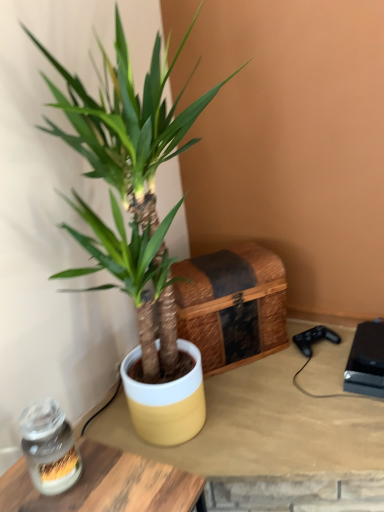
Describe the element at coordinates (232, 304) in the screenshot. The height and width of the screenshot is (512, 384). I see `woven wood chest at center` at that location.

Identify the location of wooden table at lower left, the second table when ordered from back to front. Image resolution: width=384 pixels, height=512 pixels. (107, 485).

What is the approximate width of black plastic game console at lower right?

black plastic game console at lower right is 10.26 inches in width.

The height and width of the screenshot is (512, 384). What do you see at coordinates (366, 361) in the screenshot? I see `black plastic game console at lower right` at bounding box center [366, 361].

Identify the location of yellow matte pot at center, which is the 1th table in back-to-front order. Image resolution: width=384 pixels, height=512 pixels. (264, 429).

In order to face clear glass jar at lower left, should I rotate leftwards or rightwards?

It's best to rotate left around 18.123 degrees.

You are a GUI agent. You are given a task and a screenshot of the screen. Output one action in this format:
    pyautogui.click(x=<x>, y=<y>)
    Task: Click on the woven wood chest at center
    Image resolution: width=384 pixels, height=512 pixels.
    Given the screenshot: What is the action you would take?
    pyautogui.click(x=232, y=304)

Looking at their sizes, would you say yellow matte pot at center, which is counted as the 2th table, starting from the front, is wider or thinner than woven wood chest at center?

In the image, yellow matte pot at center, which is counted as the 2th table, starting from the front, appears to be wider than woven wood chest at center.

Between yellow matte pot at center, which is counted as the 2th table, starting from the front, and woven wood chest at center, which one has less height?

yellow matte pot at center, which is counted as the 2th table, starting from the front.

Does point (262, 401) come farther from viewer compared to point (256, 311)?

No.

Can you tell me how much yellow matte pot at center, which is the 1th table in back-to-front order, and woven wood chest at center differ in facing direction?

yellow matte pot at center, which is the 1th table in back-to-front order, and woven wood chest at center are facing 26.7 degrees away from each other.

Is black plastic game console at lower right surrounded by green matte plant at center?

No, black plastic game console at lower right is not surrounded by green matte plant at center.

Which of these two, green matte plant at center or black plastic game console at lower right, stands taller?

green matte plant at center.

Can you confirm if green matte plant at center is positioned to the left of black plastic game console at lower right?

Correct, you'll find green matte plant at center to the left of black plastic game console at lower right.

Is black plastic game console at lower right at the back of green matte plant at center?

No, green matte plant at center is not facing the opposite direction of black plastic game console at lower right.

Which is closer to the camera, (125,38) or (279,309)?

Point (125,38) is positioned closer to the camera compared to point (279,309).

Which of these two, green matte plant at center or woven wood chest at center, stands taller?

Standing taller between the two is green matte plant at center.

Is green matte plant at center bigger than woven wood chest at center?

Correct, green matte plant at center is larger in size than woven wood chest at center.

Which object is wider, green matte plant at center or woven wood chest at center?

green matte plant at center is wider.

From the image's perspective, which object appears higher, wooden table at lower left, the second table when ordered from back to front, or clear glass jar at lower left?

clear glass jar at lower left is shown above in the image.

Is wooden table at lower left, the second table when ordered from back to front, positioned with its back to clear glass jar at lower left?

That's not correct — wooden table at lower left, the second table when ordered from back to front, is not looking away from clear glass jar at lower left.

Is wooden table at lower left, the first table viewed from the front, to the right of clear glass jar at lower left from the viewer's perspective?

Yes, wooden table at lower left, the first table viewed from the front, is to the right of clear glass jar at lower left.

From a real-world perspective, is wooden table at lower left, the second table when ordered from back to front, on top of clear glass jar at lower left?

No, from a real-world perspective, wooden table at lower left, the second table when ordered from back to front, is not over clear glass jar at lower left

Is yellow matte pot at center, which is the 1th table in back-to-front order, facing away from green matte plant at center?

yellow matte pot at center, which is the 1th table in back-to-front order, does not have its back to green matte plant at center.

From a real-world perspective, does yellow matte pot at center, which is the 1th table in back-to-front order, stand above green matte plant at center?

No, from a real-world perspective, yellow matte pot at center, which is the 1th table in back-to-front order, is not above green matte plant at center.

Can you tell me how much yellow matte pot at center, which is counted as the 2th table, starting from the front, and green matte plant at center differ in facing direction?

yellow matte pot at center, which is counted as the 2th table, starting from the front, and green matte plant at center are facing 65.5 degrees away from each other.

Which object is closer to the camera, yellow matte pot at center, which is the 1th table in back-to-front order, or green matte plant at center?

Positioned in front is green matte plant at center.

Based on the photo, is yellow matte pot at center, which is counted as the 2th table, starting from the front, positioned behind black plastic game console at lower right?

No, yellow matte pot at center, which is counted as the 2th table, starting from the front, is closer to the viewer.

Based on their sizes in the image, would you say yellow matte pot at center, which is counted as the 2th table, starting from the front, is bigger or smaller than black plastic game console at lower right?

yellow matte pot at center, which is counted as the 2th table, starting from the front, is bigger than black plastic game console at lower right.

Is black plastic game console at lower right completely or partially inside yellow matte pot at center, which is counted as the 2th table, starting from the front?

That's incorrect, black plastic game console at lower right is not inside yellow matte pot at center, which is counted as the 2th table, starting from the front.

Can you tell me how much yellow matte pot at center, which is counted as the 2th table, starting from the front, and black plastic game console at lower right differ in facing direction?

There is a 21.5-degree angle between the facing directions of yellow matte pot at center, which is counted as the 2th table, starting from the front, and black plastic game console at lower right.

In terms of width, does clear glass jar at lower left look wider or thinner when compared to green matte plant at center?

Clearly, clear glass jar at lower left has less width compared to green matte plant at center.

Is point (50, 413) less distant than point (166, 71)?

That is True.

From a real-world perspective, is clear glass jar at lower left physically located above or below green matte plant at center?

clear glass jar at lower left is situated lower than green matte plant at center in the real world.

You are a GUI agent. You are given a task and a screenshot of the screen. Output one action in this format:
    pyautogui.click(x=<x>, y=<y>)
    Task: Click on the 1st table below the woven wood chest at center (from the image's perspective)
    
    Given the screenshot: What is the action you would take?
    pyautogui.click(x=264, y=429)

Where is `box that appears on the right of green matte plant at center`? box that appears on the right of green matte plant at center is located at coordinates (366, 361).

Looking at the image, which one is located closer to yellow matte pot at center, which is the 1th table in back-to-front order, black plastic game console at lower right or green matte plant at center?

black plastic game console at lower right lies closer to yellow matte pot at center, which is the 1th table in back-to-front order, than the other object.

Based on their spatial positions, is clear glass jar at lower left or black plastic game console at lower right further from yellow matte pot at center, which is the 1th table in back-to-front order?

Based on the image, clear glass jar at lower left appears to be further to yellow matte pot at center, which is the 1th table in back-to-front order.

Which object lies further to the anchor point wooden table at lower left, the second table when ordered from back to front, clear glass jar at lower left or black plastic game console at lower right?

black plastic game console at lower right lies further to wooden table at lower left, the second table when ordered from back to front, than the other object.

From the picture: Which object lies further to the anchor point yellow matte pot at center, which is counted as the 2th table, starting from the front, green matte plant at center or clear glass jar at lower left?

green matte plant at center is positioned further to the anchor yellow matte pot at center, which is counted as the 2th table, starting from the front.

Estimate the real-world distances between objects in this image. Which object is further from green matte plant at center, woven wood chest at center or black plastic game console at lower right?

black plastic game console at lower right.

From the image, which object appears to be farther from yellow matte pot at center, which is counted as the 2th table, starting from the front, green matte plant at center or woven wood chest at center?

green matte plant at center lies further to yellow matte pot at center, which is counted as the 2th table, starting from the front, than the other object.

Based on their spatial positions, is clear glass jar at lower left or woven wood chest at center closer to yellow matte pot at center, which is the 1th table in back-to-front order?

woven wood chest at center lies closer to yellow matte pot at center, which is the 1th table in back-to-front order, than the other object.

Estimate the real-world distances between objects in this image. Which object is further from black plastic game console at lower right, yellow matte pot at center, which is the 1th table in back-to-front order, or clear glass jar at lower left?

clear glass jar at lower left.

Identify the location of table between wooden table at lower left, the first table viewed from the front, and woven wood chest at center, along the z-axis. (264, 429).

The height and width of the screenshot is (512, 384). Find the location of `houseplant situated between wooden table at lower left, the second table when ordered from back to front, and black plastic game console at lower right from left to right`. houseplant situated between wooden table at lower left, the second table when ordered from back to front, and black plastic game console at lower right from left to right is located at coordinates (132, 147).

Where is `crate situated between wooden table at lower left, the first table viewed from the front, and black plastic game console at lower right from left to right`? This screenshot has width=384, height=512. crate situated between wooden table at lower left, the first table viewed from the front, and black plastic game console at lower right from left to right is located at coordinates (232, 304).

Locate an element on the screen. This screenshot has width=384, height=512. table positioned between clear glass jar at lower left and woven wood chest at center from near to far is located at coordinates (264, 429).